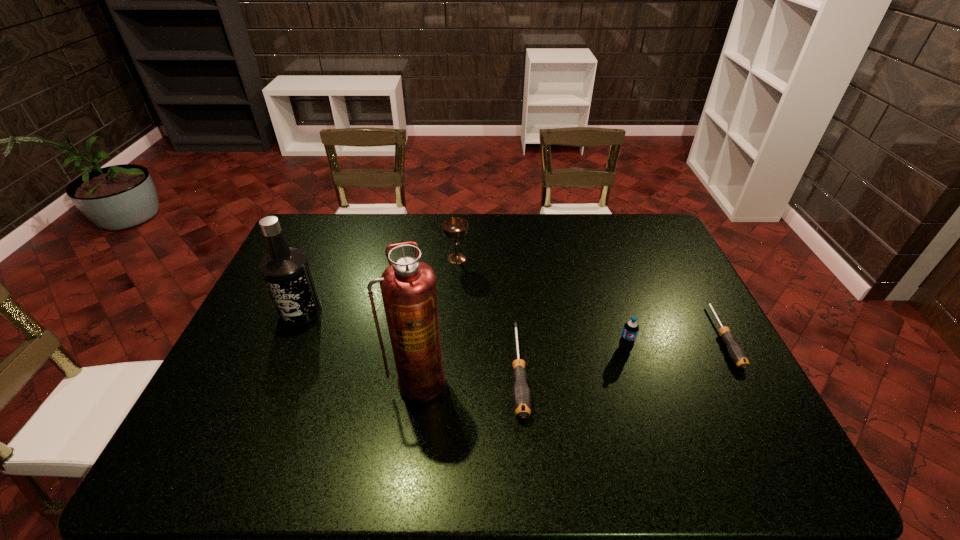
Find the location of a particular element. This screenshot has height=540, width=960. vacant area that lies between the liquor and the right screwdriver is located at coordinates (512, 323).

Identify the location of empty space that is in between the fifth object from left to right and the farthest object. This screenshot has width=960, height=540. (540, 304).

Locate which object is the fifth closest to the leftmost object. Please provide its 2D coordinates. Your answer should be formatted as a tuple, i.e. [(x, y)], where the tuple contains the x and y coordinates of a point satisfying the conditions above.

[(737, 354)]

The width and height of the screenshot is (960, 540). Identify the location of object that is the second closest one to the fire extinguisher. (286, 271).

Find the location of a particular element. The width and height of the screenshot is (960, 540). blank area in the image that satisfies the following two spatial constraints: 1. on the front side of the farthest object; 2. on the left side of the right screwdriver is located at coordinates (452, 336).

At what (x,y) coordinates should I click in order to perform the action: click on free spot that satisfies the following two spatial constraints: 1. on the front label of the fourth object from left to right; 2. on the right side of the leftmost object. Please return your answer as a coordinate pair (x, y). The image size is (960, 540). Looking at the image, I should click on (276, 371).

This screenshot has width=960, height=540. What are the coordinates of `blank space that satisfies the following two spatial constraints: 1. on the front side of the third shortest object; 2. on the right side of the chalice` in the screenshot? It's located at (451, 349).

At what (x,y) coordinates should I click in order to perform the action: click on vacant space that satisfies the following two spatial constraints: 1. on the front label of the second tallest object; 2. on the left side of the soda bottle. Please return your answer as a coordinate pair (x, y). This screenshot has width=960, height=540. Looking at the image, I should click on (285, 349).

The image size is (960, 540). I want to click on free spot that satisfies the following two spatial constraints: 1. on the front side of the chalice; 2. on the right side of the rightmost object, so click(452, 336).